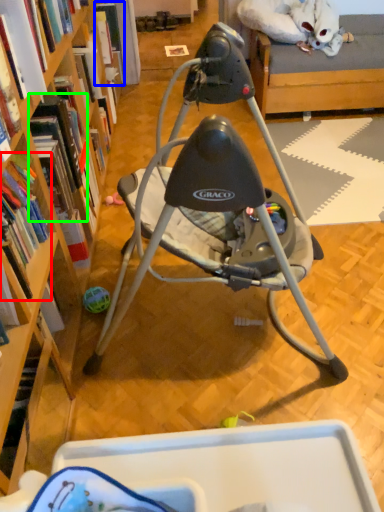
Question: Considering the real-world distances, which object is farthest from book (highlighted by a red box)? book (highlighted by a blue box) or book (highlighted by a green box)?

Choices:
 (A) book
 (B) book

Answer: (A)